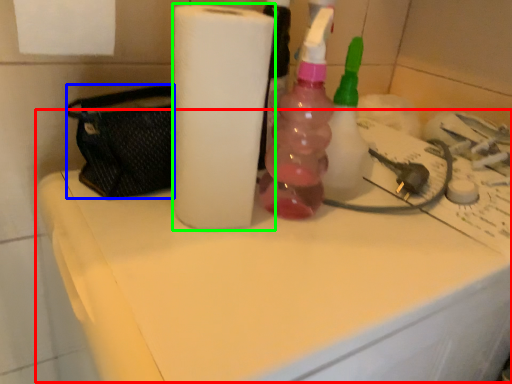
Question: Estimate the real-world distances between objects in this image. Which object is closer to counter top (highlighted by a red box), pouch (highlighted by a blue box) or paper towel (highlighted by a green box)?

Choices:
 (A) pouch
 (B) paper towel

Answer: (B)